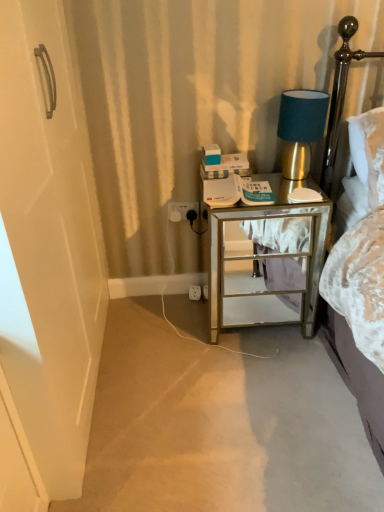
You are a GUI agent. You are given a task and a screenshot of the screen. Output one action in this format:
    pyautogui.click(x=<x>, y=<y>)
    Task: Click on the vacant space in front of mirrored glass nightstand at right
    The width and height of the screenshot is (384, 512).
    Given the screenshot: What is the action you would take?
    pyautogui.click(x=264, y=378)